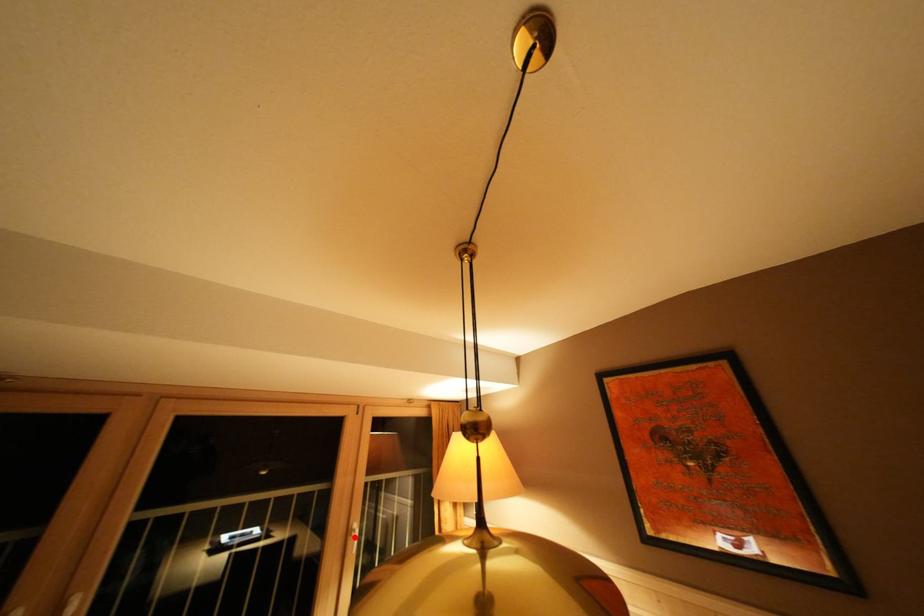
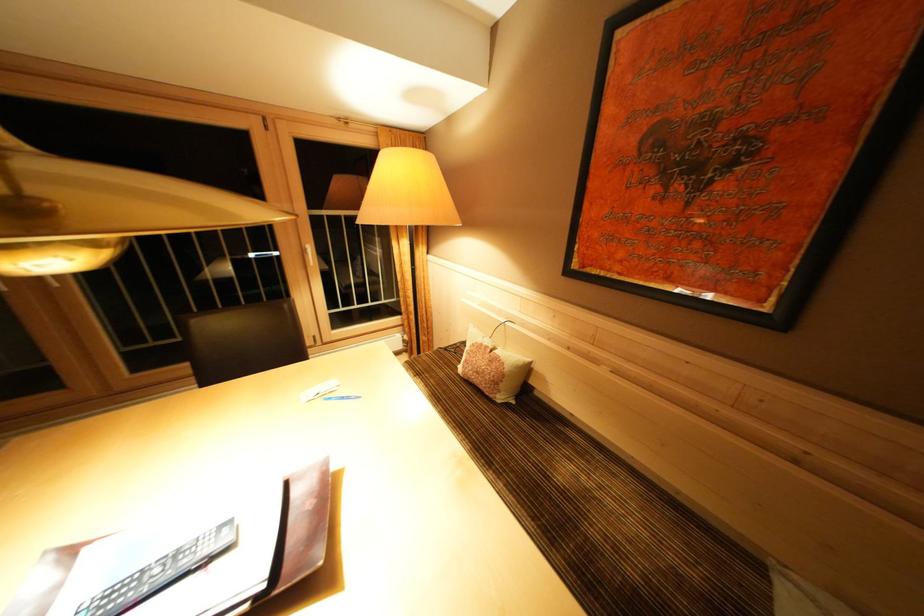
Find the pixel in the second image that matches the highlighted location in the first image.

(310, 256)